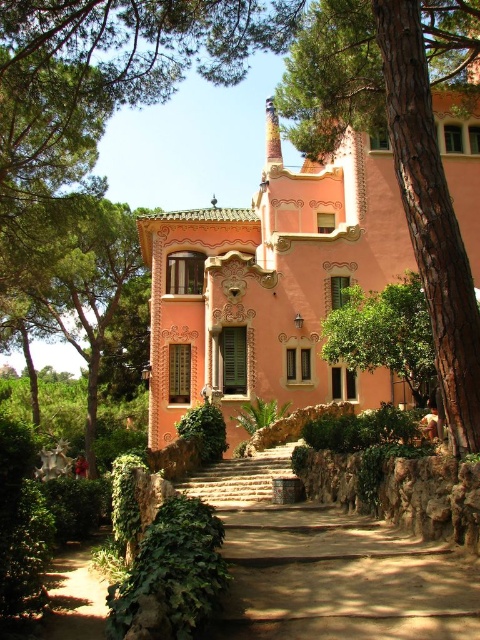
Does green textured tree at right have a greater width compared to green leafy tree at center?

Correct, the width of green textured tree at right exceeds that of green leafy tree at center.

Can you confirm if green textured tree at right is taller than green leafy tree at center?

Correct, green textured tree at right is much taller as green leafy tree at center.

Which is behind, point (400, 29) or point (418, 280)?

Positioned behind is point (418, 280).

Find the location of a particular element. green textured tree at right is located at coordinates (398, 145).

Which is more to the right, green leafy tree at center or brown stone stairs at center?

green leafy tree at center is more to the right.

In the scene shown: Does green leafy tree at center appear under brown stone stairs at center?

No, green leafy tree at center is not below brown stone stairs at center.

Image resolution: width=480 pixels, height=640 pixels. Find the location of `green leafy tree at center`. green leafy tree at center is located at coordinates (384, 333).

This screenshot has height=640, width=480. What are the coordinates of `green leafy tree at center` in the screenshot? It's located at (384, 333).

Consider the image. Who is lower down, brown stone path at center or brown stone stairs at center?

Positioned lower is brown stone path at center.

From the picture: Does brown stone path at center have a greater width compared to brown stone stairs at center?

Indeed, brown stone path at center has a greater width compared to brown stone stairs at center.

I want to click on brown stone path at center, so click(328, 564).

At what (x,y) coordinates should I click in order to perform the action: click on brown stone path at center. Please return your answer as a coordinate pair (x, y). This screenshot has width=480, height=640. Looking at the image, I should click on click(x=328, y=564).